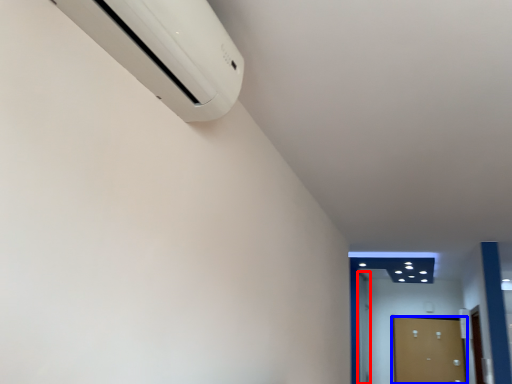
Question: Which object is further to the camera taking this photo, door (highlighted by a red box) or door (highlighted by a blue box)?

Choices:
 (A) door
 (B) door

Answer: (B)